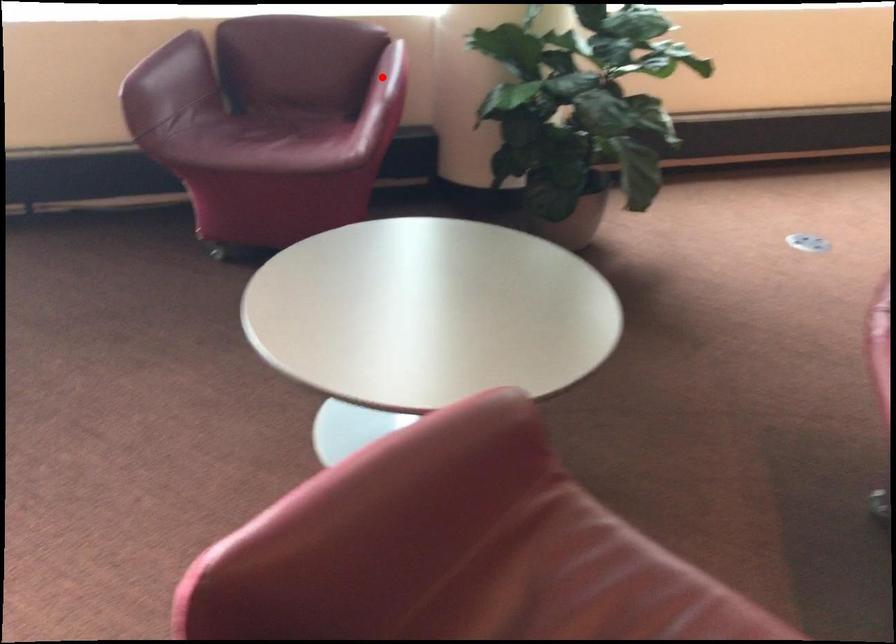
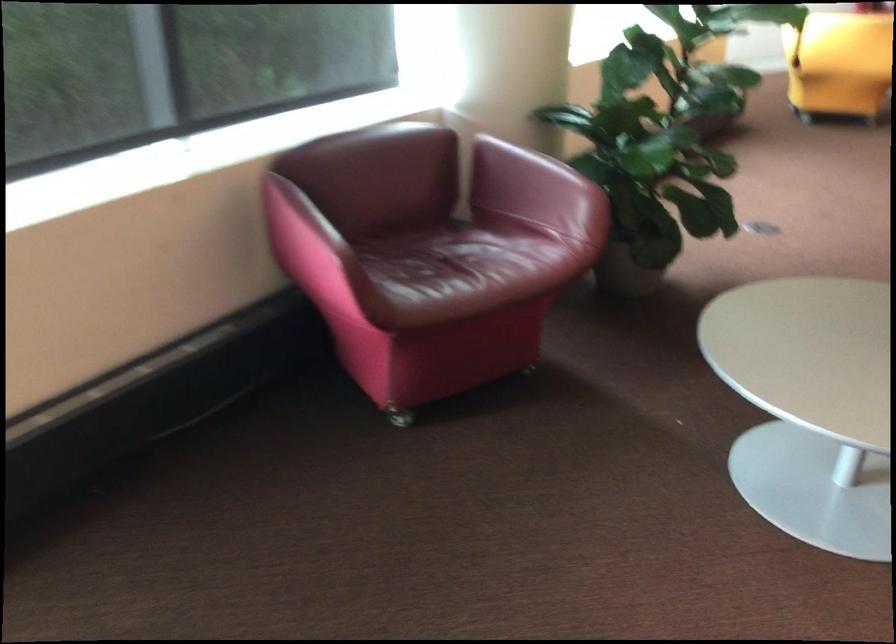
Locate, in the second image, the point that corresponds to the highlighted location in the first image.

(543, 169)